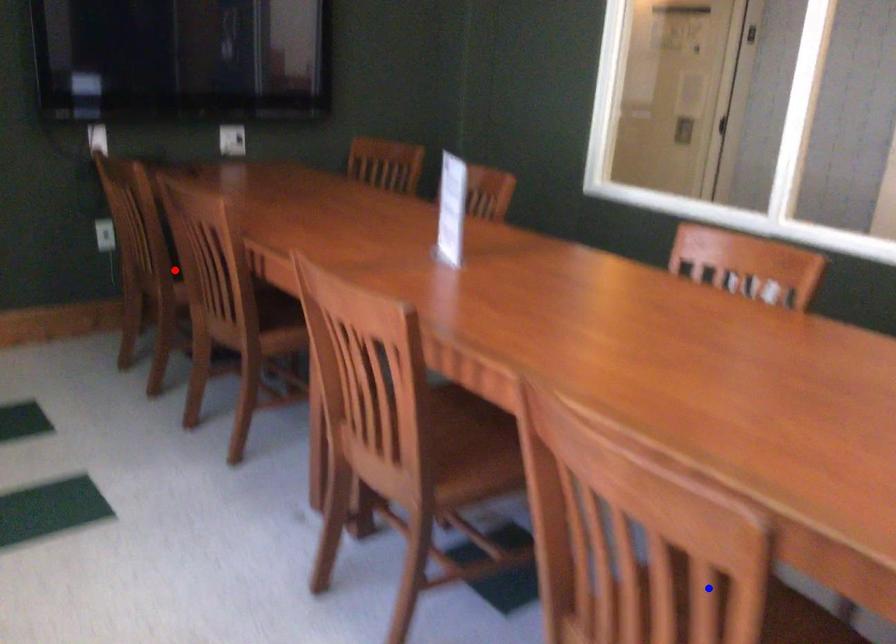
Question: Two points are marked on the image. Which point is closer to the camera?

Choices:
 (A) Blue point is closer.
 (B) Red point is closer.

Answer: (A)